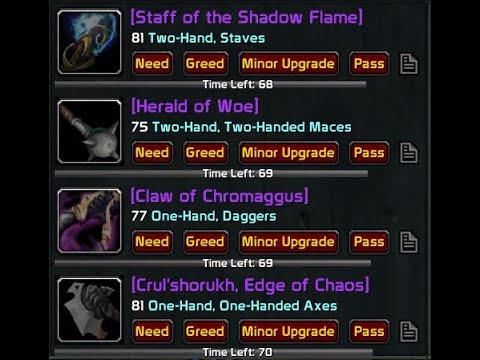
Where is `leather handle`? leather handle is located at coordinates (66, 113).